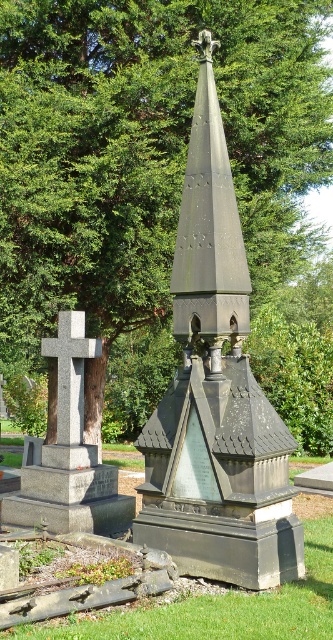
You are a groundskeeper tasked with placing a new 1.2 meter wide flower bed between the dark gray stone spire at center and the granite cross at left. Based on their widths, will the flower bed fit between them?

The dark gray stone spire at center has a lesser width compared to granite cross at left. Since the flower bed is 1.2 meters wide, and the distance between them is not specified, we cannot determine if it will fit. Please check the actual space between them.

You are a groundskeeper planning to mow the lawn between the dark gray stone spire at center and the granite cross at left. Your lawnmower has a maximum turning radius of 2 feet. Can you navigate the space between them without hitting either structure?

The distance between the dark gray stone spire at center and the granite cross at left is 6.05 feet. Since the lawnmower requires a minimum of 4 feet to maneuver its turning radius, it should be possible to navigate between them safely without collision.